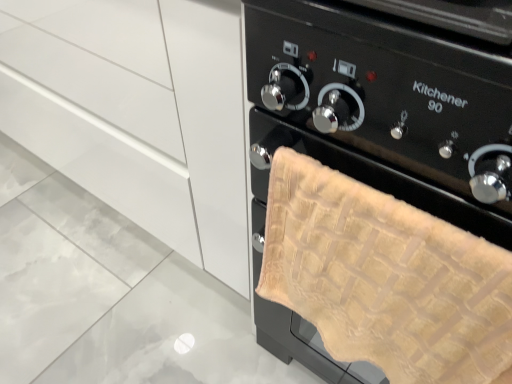
This screenshot has width=512, height=384. What do you see at coordinates (138, 114) in the screenshot?
I see `matte white cabinet at center` at bounding box center [138, 114].

What is the approximate width of matte white cabinet at center?

23.55 inches.

What is the approximate height of matte white cabinet at center?

matte white cabinet at center is 34.04 inches in height.

Locate an element on the screen. This screenshot has width=512, height=384. matte white cabinet at center is located at coordinates (138, 114).

Identify the location of beige textured towel at right. This screenshot has width=512, height=384. (385, 104).

The image size is (512, 384). Describe the element at coordinates (385, 104) in the screenshot. I see `beige textured towel at right` at that location.

Locate an element on the screen. matte white cabinet at center is located at coordinates (138, 114).

Which is more to the left, beige textured towel at right or matte white cabinet at center?

Positioned to the left is matte white cabinet at center.

Is beige textured towel at right positioned in front of matte white cabinet at center?

Yes, beige textured towel at right is in front of matte white cabinet at center.

Is point (286, 105) positioned behind point (206, 30)?

No, it is in front of (206, 30).

From the image's perspective, is beige textured towel at right positioned above or below matte white cabinet at center?

Clearly, from the image's perspective, beige textured towel at right is below matte white cabinet at center.

From a real-world perspective, which is physically above, beige textured towel at right or matte white cabinet at center?

In real-world perspective, beige textured towel at right is above.

Between beige textured towel at right and matte white cabinet at center, which one has smaller width?

beige textured towel at right.

Which of these two, beige textured towel at right or matte white cabinet at center, stands shorter?

Standing shorter between the two is beige textured towel at right.

Considering the relative sizes of beige textured towel at right and matte white cabinet at center in the image provided, is beige textured towel at right smaller than matte white cabinet at center?

Yes, beige textured towel at right is smaller than matte white cabinet at center.

Would you say beige textured towel at right is inside or outside matte white cabinet at center?

beige textured towel at right exists outside the volume of matte white cabinet at center.

Is there a large distance between beige textured towel at right and matte white cabinet at center?

That's not correct — beige textured towel at right is a little close to matte white cabinet at center.

Is beige textured towel at right aimed at matte white cabinet at center?

No, beige textured towel at right is not oriented towards matte white cabinet at center.

What's the angular difference between beige textured towel at right and matte white cabinet at center's facing directions?

beige textured towel at right and matte white cabinet at center are facing 1.65 degrees away from each other.

I want to click on cabinetry behind the beige textured towel at right, so click(x=138, y=114).

Is matte white cabinet at center at the left side of beige textured towel at right?

Yes, matte white cabinet at center is to the left of beige textured towel at right.

Which object is closer to the camera taking this photo, matte white cabinet at center or beige textured towel at right?

beige textured towel at right.

Is point (212, 43) farther from viewer compared to point (316, 35)?

Yes, point (212, 43) is behind point (316, 35).

From the image's perspective, is matte white cabinet at center located beneath beige textured towel at right?

No, from the image's perspective, matte white cabinet at center is not beneath beige textured towel at right.

From a real-world perspective, does matte white cabinet at center stand above beige textured towel at right?

No, from a real-world perspective, matte white cabinet at center is not over beige textured towel at right

Considering the relative sizes of matte white cabinet at center and beige textured towel at right in the image provided, is matte white cabinet at center wider than beige textured towel at right?

Yes.

Considering the sizes of objects matte white cabinet at center and beige textured towel at right in the image provided, who is shorter, matte white cabinet at center or beige textured towel at right?

beige textured towel at right is shorter.

Can you confirm if matte white cabinet at center is smaller than beige textured towel at right?

No, matte white cabinet at center is not smaller than beige textured towel at right.

Is matte white cabinet at center spatially inside beige textured towel at right, or outside of it?

matte white cabinet at center is located beyond the bounds of beige textured towel at right.

Is matte white cabinet at center beside beige textured towel at right?

No, matte white cabinet at center is not in contact with beige textured towel at right.

Is beige textured towel at right at the back of matte white cabinet at center?

No, beige textured towel at right is not at the back of matte white cabinet at center.

How different are the orientations of matte white cabinet at center and beige textured towel at right in degrees?

matte white cabinet at center and beige textured towel at right are facing 1.65 degrees away from each other.

Identify the location of cabinetry above the beige textured towel at right (from the image's perspective). (138, 114).

You are a GUI agent. You are given a task and a screenshot of the screen. Output one action in this format:
    pyautogui.click(x=<x>, y=<y>)
    Task: Click on the cabinetry behind the beige textured towel at right
    This screenshot has width=512, height=384.
    Given the screenshot: What is the action you would take?
    pyautogui.click(x=138, y=114)

The height and width of the screenshot is (384, 512). I want to click on home appliance below the matte white cabinet at center (from the image's perspective), so click(385, 104).